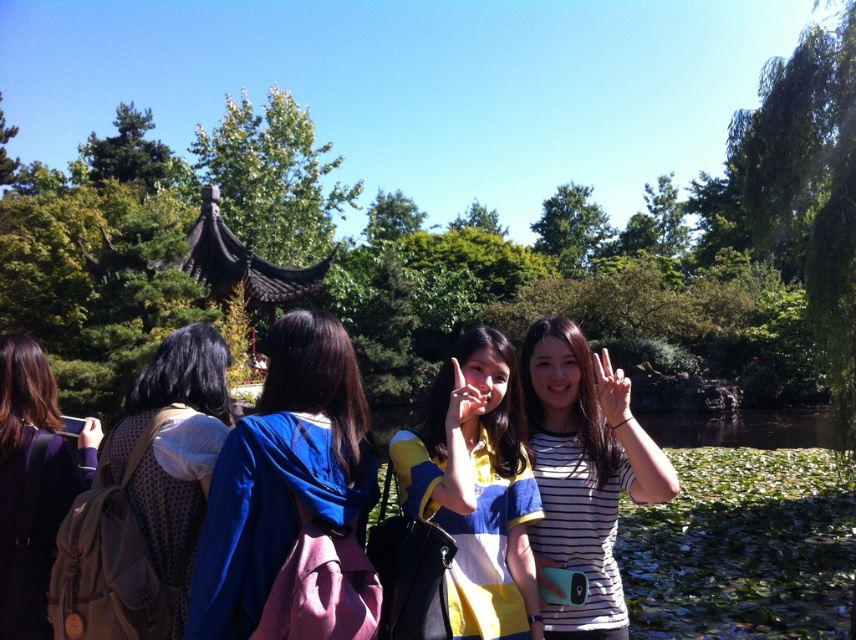
You are a photographer trying to adjust your focus for the photo shoot. You notice two points in the scene at coordinates point (56, 481) and point (480, 396). Which point should you focus on first to ensure the foreground elements are sharp?

You should focus on point (56, 481) first because it is closer to the camera than point (480, 396), ensuring the foreground elements are in focus.

You are standing in the park scene and want to know which of the two points is closer to you. The points are labeled as point (420, 452) and point (84, 445). Which point is closer?

Point (420, 452) is in front of point (84, 445), so it is closer to you.